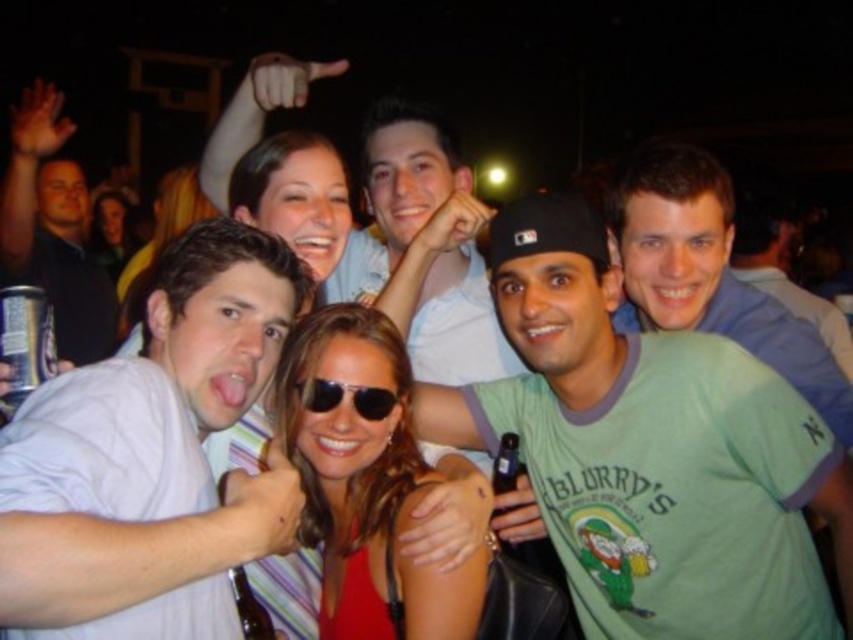
Question: Can you confirm if black reflective sunglasses at center is bigger than translucent plastic beer bottle at lower center?

Choices:
 (A) yes
 (B) no

Answer: (B)

Question: Estimate the real-world distances between objects in this image. Which object is farther from the green cotton shirt at center?

Choices:
 (A) translucent plastic beer bottle at lower center
 (B) green t-shirt at center
 (C) black reflective sunglasses at center

Answer: (B)

Question: Is green cotton t-shirt at center bigger than translucent plastic beer bottle at lower center?

Choices:
 (A) no
 (B) yes

Answer: (B)

Question: Which object is the closest to the matte black can at left?

Choices:
 (A) black reflective sunglasses at center
 (B) green cotton shirt at center
 (C) green t-shirt at center

Answer: (A)

Question: Which of the following is the closest to the observer?

Choices:
 (A) (706, 413)
 (B) (758, 232)

Answer: (A)

Question: In this image, where is green cotton t-shirt at center located relative to green cotton shirt at center?

Choices:
 (A) above
 (B) below

Answer: (B)